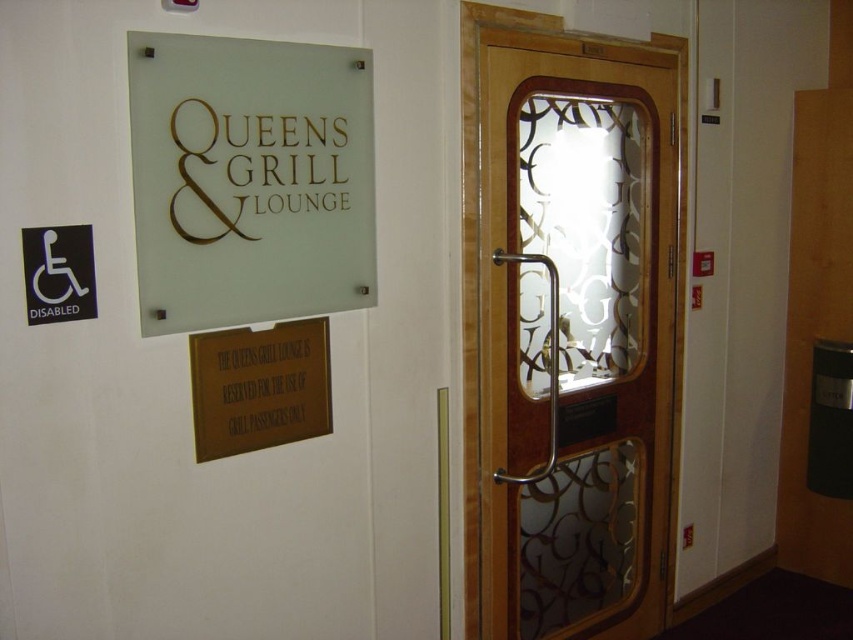
Does frosted glass sign at upper left have a lesser height compared to gold metallic plaque at lower center?

No.

Does point (306, 234) come farther from viewer compared to point (242, 413)?

Yes, point (306, 234) is farther from viewer.

The height and width of the screenshot is (640, 853). Find the location of `frosted glass sign at upper left`. frosted glass sign at upper left is located at coordinates (248, 179).

Does point (532, 45) come behind point (323, 65)?

Yes, it is behind point (323, 65).

This screenshot has height=640, width=853. What do you see at coordinates (572, 333) in the screenshot? I see `translucent wood door at right` at bounding box center [572, 333].

Find the location of a particular element. translucent wood door at right is located at coordinates (572, 333).

Looking at this image, who is higher up, frosted glass sign at upper left or black plastic sign at left?

frosted glass sign at upper left

Measure the distance from frosted glass sign at upper left to black plastic sign at left.

The distance of frosted glass sign at upper left from black plastic sign at left is 14.07 inches.

Find the location of a particular element. Image resolution: width=853 pixels, height=640 pixels. frosted glass sign at upper left is located at coordinates coord(248,179).